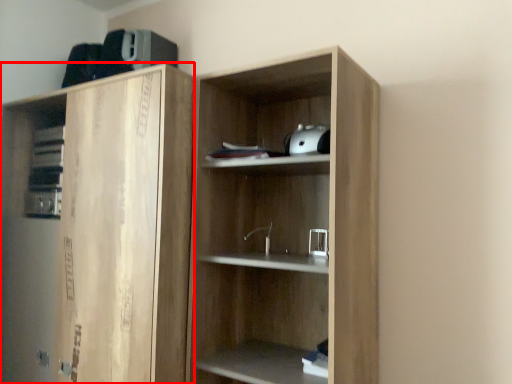
Question: From the image's perspective, where is cabinetry (annotated by the red box) located relative to cupboard?

Choices:
 (A) above
 (B) below

Answer: (B)